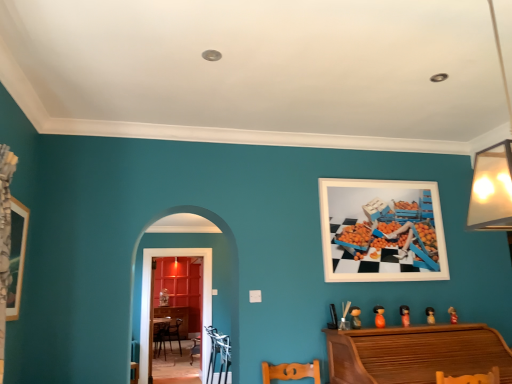
Where is `empty space that is to the right of matte wooden doll at lower center, which appears as the 1th toy when viewed from the left`? The height and width of the screenshot is (384, 512). empty space that is to the right of matte wooden doll at lower center, which appears as the 1th toy when viewed from the left is located at coordinates coord(379,329).